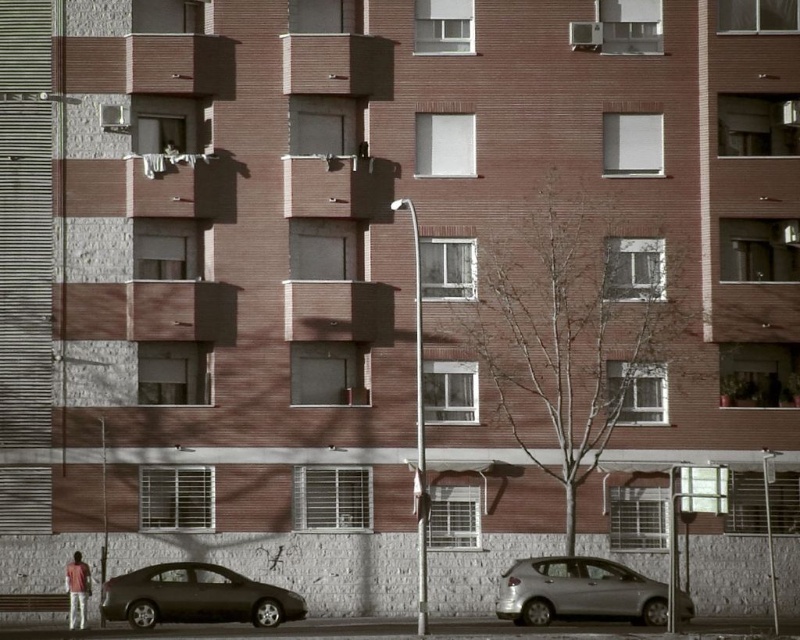
Question: Which object is farther from the camera taking this photo?

Choices:
 (A) matte black sedan at lower left
 (B) silver metallic car at lower center

Answer: (A)

Question: Which is nearer to the silver metallic car at lower center?

Choices:
 (A) matte black sedan at lower left
 (B) matte red shirt at lower left

Answer: (A)

Question: Does matte black sedan at lower left appear under matte red shirt at lower left?

Choices:
 (A) no
 (B) yes

Answer: (A)

Question: Which of the following is the closest to the observer?

Choices:
 (A) (81, 576)
 (B) (214, 605)
 (C) (632, 586)

Answer: (C)

Question: Does matte black sedan at lower left have a larger size compared to silver metallic car at lower center?

Choices:
 (A) no
 (B) yes

Answer: (B)

Question: Can you confirm if matte black sedan at lower left is positioned to the left of silver metallic car at lower center?

Choices:
 (A) yes
 (B) no

Answer: (A)